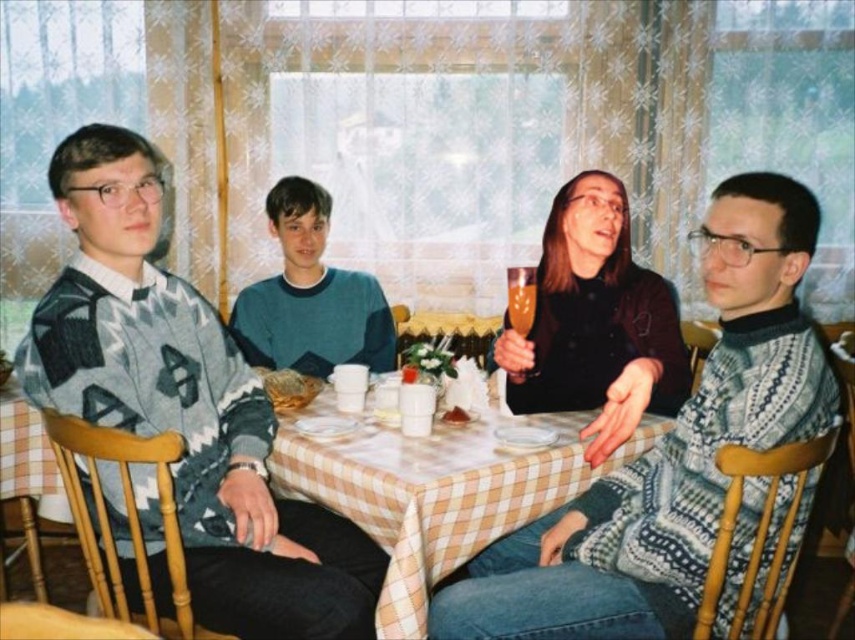
You are a guest at this cozy indoor gathering and want to place your phone on the surface between the checkered fabric table at center and the translucent glass at center. Which surface can you use?

The checkered fabric table at center is taller than the translucent glass at center, so you can place your phone on the checkered fabric table at center since it is the higher surface.

You are planning to place a new item on the dining table. The item is 15 cm in width. The knitted sweater at center and the translucent glass at center are already on the table. Can the new item fit between them without overlapping?

The knitted sweater at center has a larger size compared to translucent glass at center. Since the sweater is larger, there might be enough space between them for the new item, but the exact dimensions are not provided. However, since the sweater is larger, it is possible that the space between them could accommodate the 15 cm item. But without knowing the exact distance between them, it is uncertain.

You are a guest at this table and want to place your phone on the checkered fabric table at center without it sliding off. Considering the translucent glass at center is in the way, where should you place your phone?

The checkered fabric table at center is closer to the viewer than the translucent glass at center, so you should place your phone on the part of the checkered fabric table at center that is nearest to you, away from the translucent glass at center to prevent it from sliding off.